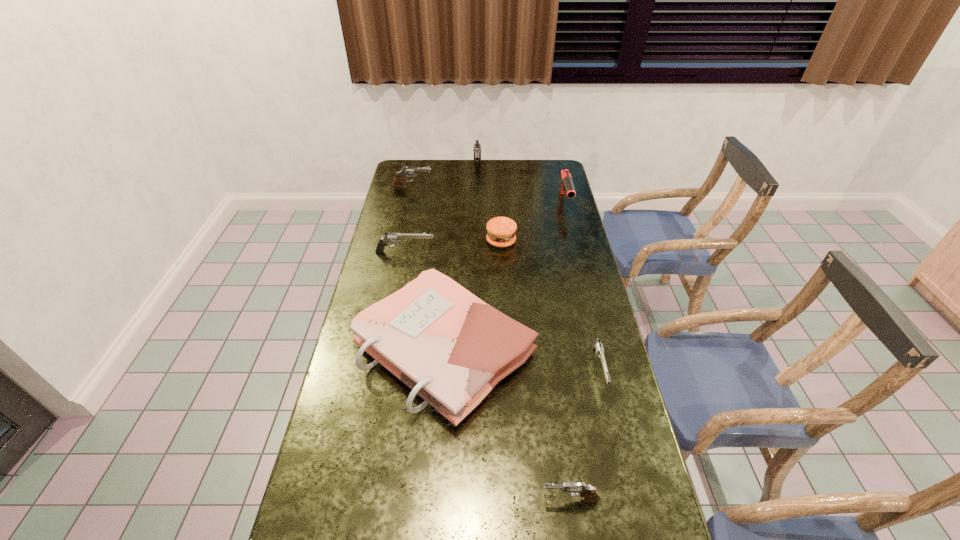
You are a GUI agent. You are given a task and a screenshot of the screen. Output one action in this format:
    pyautogui.click(x=<x>, y=<y>)
    Task: Click on the tallest pistol
    This screenshot has height=540, width=960.
    Given the screenshot: What is the action you would take?
    pyautogui.click(x=477, y=147)

Find the location of a particular element. the third pistol from right to left is located at coordinates (477, 147).

Where is `black gun`? The height and width of the screenshot is (540, 960). black gun is located at coordinates (566, 184).

The image size is (960, 540). What are the coordinates of `the leftmost gray pistol` in the screenshot? It's located at (407, 171).

The image size is (960, 540). Find the location of `the fourth shortest pistol`. the fourth shortest pistol is located at coordinates (407, 171).

You are a GUI agent. You are given a task and a screenshot of the screen. Output one action in this format:
    pyautogui.click(x=<x>, y=<y>)
    Task: Click on the phonebook
    This screenshot has height=540, width=960.
    Given the screenshot: What is the action you would take?
    pyautogui.click(x=448, y=346)

In order to click on patty in this screenshot , I will do `click(500, 230)`.

Locate an element on the screen. the bigger silver pistol is located at coordinates (389, 237).

Identify the location of the left silver pistol. The width and height of the screenshot is (960, 540). (389, 237).

Where is `the nearest pistol`? The height and width of the screenshot is (540, 960). the nearest pistol is located at coordinates (590, 493).